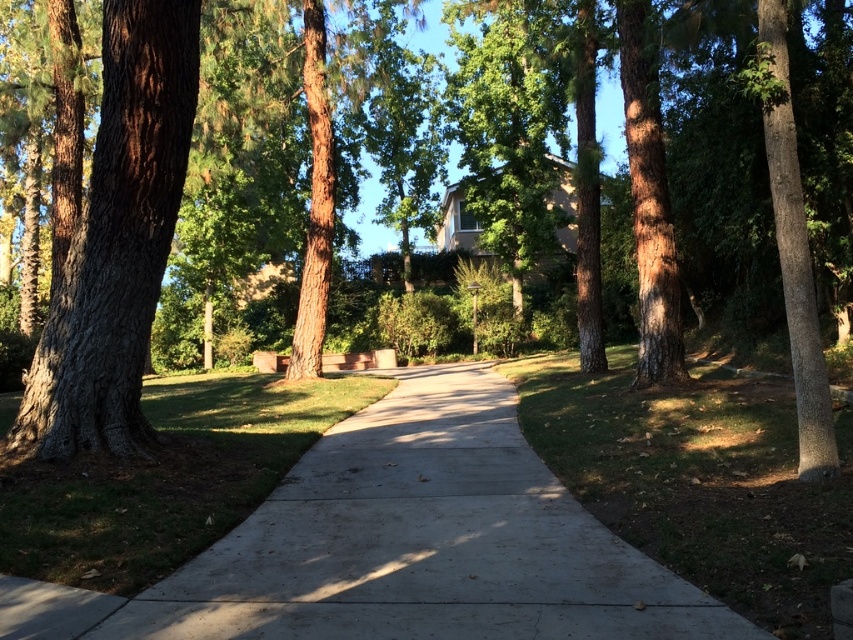
You are standing at the camera position looking at the driveway. There are two points marked on the driveway, one at point coordinates (343,592) and another at (148,308). Which point is closer to you?

Point (343,592) is closer to the camera than point (148,308).